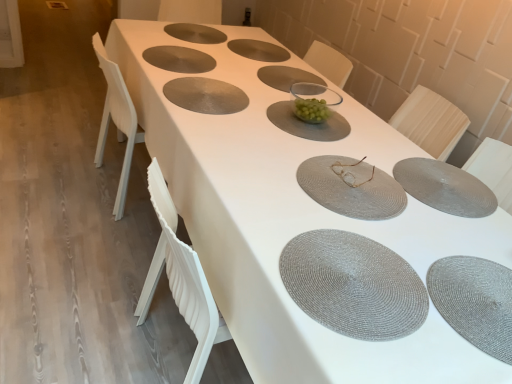
Find the location of a particular element. Image resolution: width=512 pixels, height=384 pixels. free space on the front side of matte gray placemat at center, the seventh tableware when ordered from top to bottom is located at coordinates (344, 224).